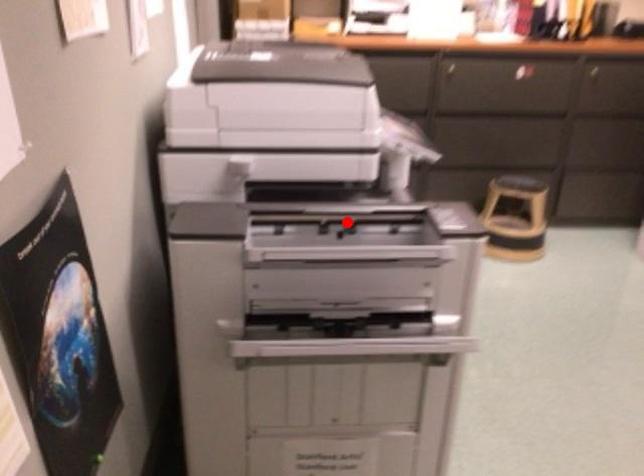
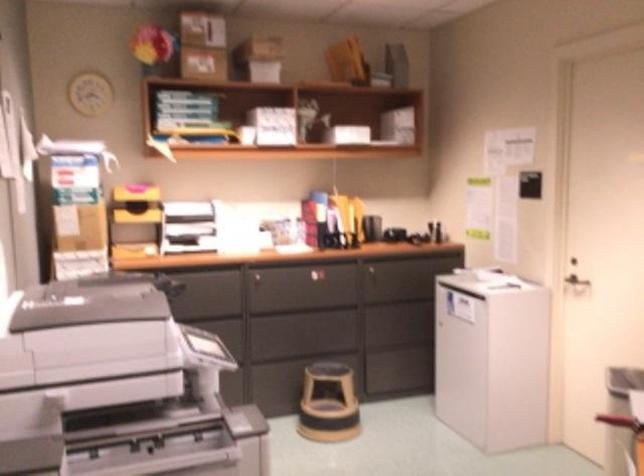
Question: I am providing you with two images of the same scene from different viewpoints. Given a red point in image1, look at the same physical point in image2. Is it:

Choices:
 (A) Closer to the viewpoint
 (B) Farther from the viewpoint

Answer: (B)